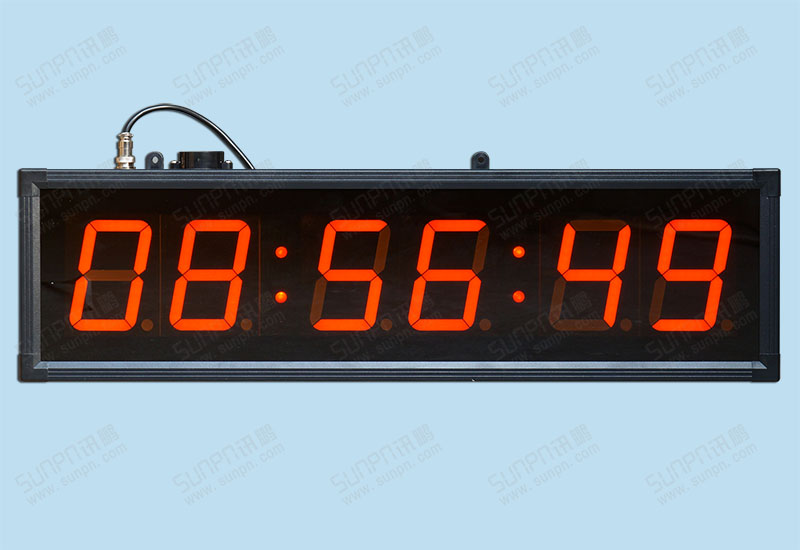
At what (x,y) coordinates should I click in order to perform the action: click on knob. Please return your answer as a coordinate pair (x, y). The height and width of the screenshot is (550, 800). Looking at the image, I should click on (201, 166).